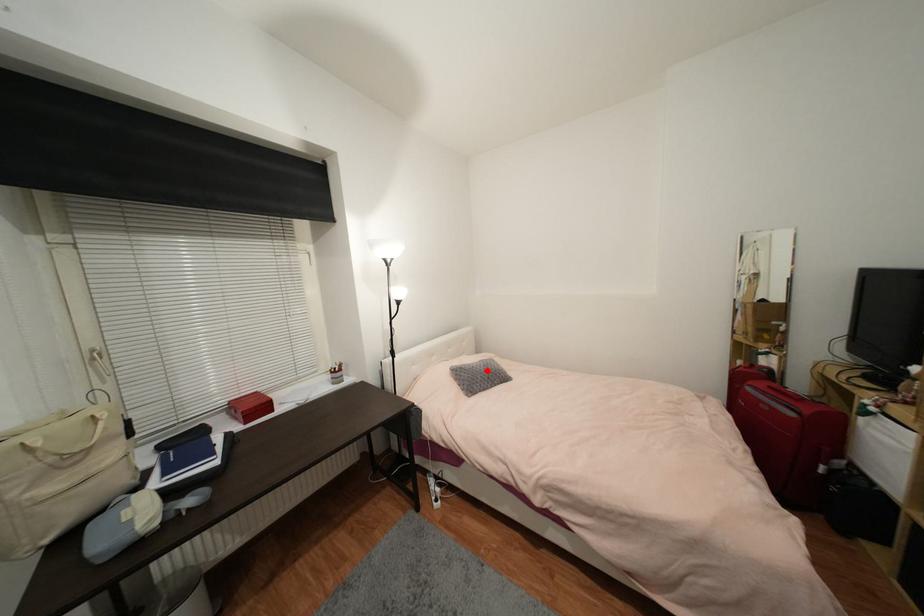
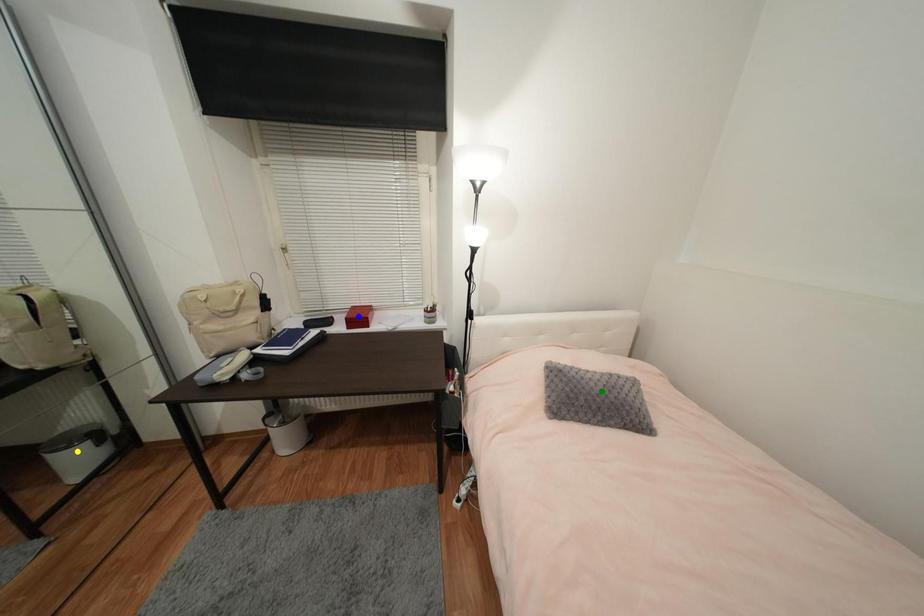
Question: I am providing you with two images of the same scene from different viewpoints. A red point is marked on the first image. You are given multiple points on the second image. Which point in image 2 represents the same 3d spot as the red point in image 1?

Choices:
 (A) green point
 (B) yellow point
 (C) blue point

Answer: (A)